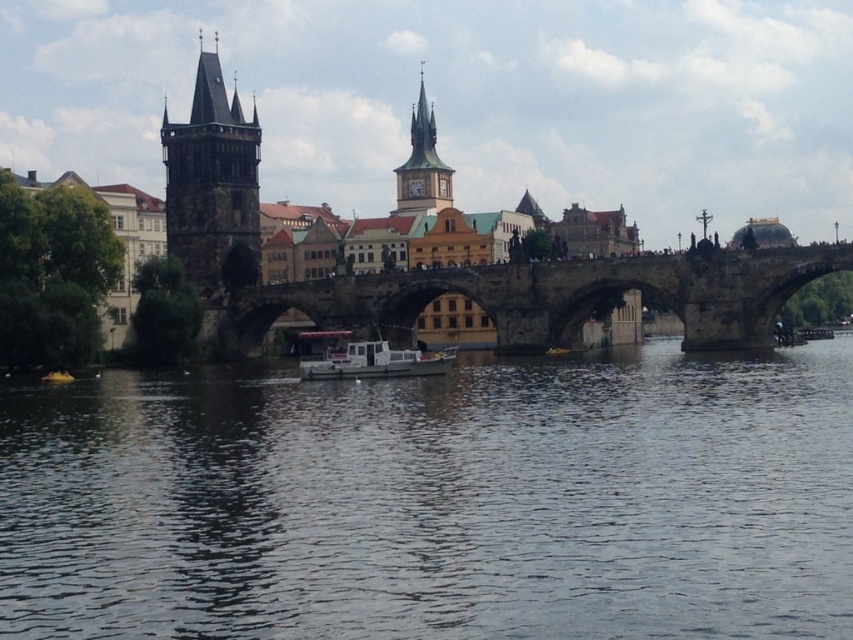
Question: Which of the following is the farthest from the observer?

Choices:
 (A) (502, 376)
 (B) (410, 368)
 (C) (442, 204)
 (D) (173, 132)

Answer: (C)

Question: Which of the following is the closest to the observer?

Choices:
 (A) white matte boat at center
 (B) brown stone bridge at center

Answer: (A)

Question: Is brown stone bridge at center positioned at the back of dark stone tower at left?

Choices:
 (A) no
 (B) yes

Answer: (A)

Question: Is dark stone tower at left thinner than golden stone clock tower at upper center?

Choices:
 (A) no
 (B) yes

Answer: (A)

Question: Estimate the real-world distances between objects in this image. Which object is farther from the golden stone clock tower at upper center?

Choices:
 (A) dark stone tower at left
 (B) brown stone bridge at center
 (C) dark blue water at center
 (D) white matte boat at center

Answer: (C)

Question: Is brown stone bridge at center wider than golden stone clock tower at upper center?

Choices:
 (A) no
 (B) yes

Answer: (B)